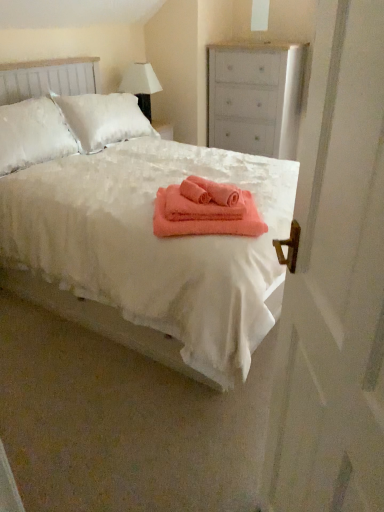
Image resolution: width=384 pixels, height=512 pixels. What do you see at coordinates (147, 241) in the screenshot? I see `white fluffy bed at center` at bounding box center [147, 241].

The width and height of the screenshot is (384, 512). I want to click on coral soft towel at center, the second bath towel when ordered from top to bottom, so click(205, 210).

At what (x,y) coordinates should I click in order to perform the action: click on white matte chest of drawers at upper right. Please return your answer as a coordinate pair (x, y). Looking at the image, I should click on (256, 97).

Is white fabric lampshade at upper center at the back of coral soft towel at center, the 1th bath towel in the bottom-to-top sequence?

Yes, white fabric lampshade at upper center is at the back of coral soft towel at center, the 1th bath towel in the bottom-to-top sequence.

Is coral soft towel at center, the 1th bath towel in the bottom-to-top sequence, far away from white fabric lampshade at upper center?

Yes.

Considering the relative sizes of coral soft towel at center, the 1th bath towel in the bottom-to-top sequence, and white fabric lampshade at upper center in the image provided, is coral soft towel at center, the 1th bath towel in the bottom-to-top sequence, thinner than white fabric lampshade at upper center?

In fact, coral soft towel at center, the 1th bath towel in the bottom-to-top sequence, might be wider than white fabric lampshade at upper center.

From the image's perspective, is white matte chest of drawers at upper right located beneath white matte screen door at right?

No.

Considering the relative sizes of white matte chest of drawers at upper right and white matte screen door at right in the image provided, is white matte chest of drawers at upper right smaller than white matte screen door at right?

Actually, white matte chest of drawers at upper right might be larger than white matte screen door at right.

Find the location of a particular element. This screenshot has width=384, height=512. chest of drawers above the white matte screen door at right (from the image's perspective) is located at coordinates (256, 97).

Considering the sizes of objects white matte screen door at right and coral soft towel at center, the 2th bath towel ordered from the bottom, in the image provided, who is bigger, white matte screen door at right or coral soft towel at center, the 2th bath towel ordered from the bottom,?

Bigger between the two is white matte screen door at right.

From a real-world perspective, which object rests below the other?

white matte screen door at right is physically lower.

Is white matte screen door at right not inside coral soft towel at center, which appears as the first bath towel when viewed from the top?

Yes.

The height and width of the screenshot is (512, 384). I want to click on the 2nd bath towel above when counting from the white matte screen door at right (from the image's perspective), so click(x=197, y=205).

Is white fabric lampshade at upper center smaller than coral soft towel at center, which appears as the first bath towel when viewed from the top?

Incorrect, white fabric lampshade at upper center is not smaller in size than coral soft towel at center, which appears as the first bath towel when viewed from the top.

There is a white fabric lampshade at upper center. Where is `the 1st bath towel below it (from the image's perspective)`? The height and width of the screenshot is (512, 384). the 1st bath towel below it (from the image's perspective) is located at coordinates (197, 205).

From the image's perspective, is white fabric lampshade at upper center located above or below coral soft towel at center, which appears as the first bath towel when viewed from the top?

Based on their image positions, white fabric lampshade at upper center is located above coral soft towel at center, which appears as the first bath towel when viewed from the top.

Which is behind, white matte chest of drawers at upper right or coral soft towel at center, the second bath towel when ordered from top to bottom?

white matte chest of drawers at upper right.

Considering the relative sizes of white matte chest of drawers at upper right and coral soft towel at center, the second bath towel when ordered from top to bottom, in the image provided, is white matte chest of drawers at upper right shorter than coral soft towel at center, the second bath towel when ordered from top to bottom,?

In fact, white matte chest of drawers at upper right may be taller than coral soft towel at center, the second bath towel when ordered from top to bottom.

This screenshot has width=384, height=512. I want to click on the chest of drawers positioned vertically above the coral soft towel at center, the second bath towel when ordered from top to bottom (from a real-world perspective), so click(x=256, y=97).

Is white matte chest of drawers at upper right turned away from coral soft towel at center, the second bath towel when ordered from top to bottom?

No, white matte chest of drawers at upper right is not facing away from coral soft towel at center, the second bath towel when ordered from top to bottom.

Based on the photo, from the image's perspective, which one is positioned lower, white matte screen door at right or coral soft towel at center, the 1th bath towel in the bottom-to-top sequence?

white matte screen door at right, from the image's perspective.

Does white matte screen door at right appear on the left side of coral soft towel at center, the second bath towel when ordered from top to bottom?

In fact, white matte screen door at right is to the right of coral soft towel at center, the second bath towel when ordered from top to bottom.

Is white matte screen door at right next to coral soft towel at center, the second bath towel when ordered from top to bottom?

white matte screen door at right and coral soft towel at center, the second bath towel when ordered from top to bottom, are not in contact.

Which of these two, white matte screen door at right or coral soft towel at center, the second bath towel when ordered from top to bottom, is bigger?

white matte screen door at right.

Does point (223, 215) lie in front of point (363, 94)?

No, (223, 215) is further to viewer.

Does coral soft towel at center, the 2th bath towel ordered from the bottom, have a larger size compared to white matte screen door at right?

Incorrect, coral soft towel at center, the 2th bath towel ordered from the bottom, is not larger than white matte screen door at right.

Who is more distant, coral soft towel at center, which appears as the first bath towel when viewed from the top, or white matte screen door at right?

coral soft towel at center, which appears as the first bath towel when viewed from the top, is behind.

Is coral soft towel at center, the 2th bath towel ordered from the bottom, facing away from white matte screen door at right?

No, coral soft towel at center, the 2th bath towel ordered from the bottom, is not facing the opposite direction of white matte screen door at right.

Locate an element on the screen. the 2nd bath towel directly beneath the white fabric lampshade at upper center (from a real-world perspective) is located at coordinates (205, 210).

In order to click on screen door located below the white matte chest of drawers at upper right (from the image's perspective) in this screenshot , I will do `click(335, 282)`.

Looking at the image, which one is located further to coral soft towel at center, the second bath towel when ordered from top to bottom, white matte chest of drawers at upper right or white matte screen door at right?

The object further to coral soft towel at center, the second bath towel when ordered from top to bottom, is white matte chest of drawers at upper right.

Which object lies further to the anchor point white fabric lampshade at upper center, white fluffy bed at center or white matte screen door at right?

white matte screen door at right is positioned further to the anchor white fabric lampshade at upper center.

Looking at this image, which object lies nearer to the anchor point white fluffy bed at center, coral soft towel at center, the 2th bath towel ordered from the bottom, or white matte screen door at right?

coral soft towel at center, the 2th bath towel ordered from the bottom, is closer to white fluffy bed at center.

When comparing their distances from white fabric lampshade at upper center, does white fluffy bed at center or coral soft towel at center, which appears as the first bath towel when viewed from the top, seem closer?

white fluffy bed at center.

When comparing their distances from coral soft towel at center, the 1th bath towel in the bottom-to-top sequence, does coral soft towel at center, the 2th bath towel ordered from the bottom, or white matte chest of drawers at upper right seem further?

Among the two, white matte chest of drawers at upper right is located further to coral soft towel at center, the 1th bath towel in the bottom-to-top sequence.

Which object lies nearer to the anchor point white fluffy bed at center, white fabric lampshade at upper center or white matte chest of drawers at upper right?

Among the two, white fabric lampshade at upper center is located nearer to white fluffy bed at center.

Based on their spatial positions, is coral soft towel at center, the second bath towel when ordered from top to bottom, or coral soft towel at center, which appears as the first bath towel when viewed from the top, further from white matte screen door at right?

coral soft towel at center, which appears as the first bath towel when viewed from the top, is further to white matte screen door at right.

From the image, which object appears to be nearer to white matte chest of drawers at upper right, coral soft towel at center, the 2th bath towel ordered from the bottom, or white fabric lampshade at upper center?

The object closer to white matte chest of drawers at upper right is white fabric lampshade at upper center.

Where is `bath towel between white fluffy bed at center and coral soft towel at center, the 2th bath towel ordered from the bottom, in the front-back direction`? The height and width of the screenshot is (512, 384). bath towel between white fluffy bed at center and coral soft towel at center, the 2th bath towel ordered from the bottom, in the front-back direction is located at coordinates (205, 210).

The height and width of the screenshot is (512, 384). Find the location of `bed positioned between white matte screen door at right and coral soft towel at center, the second bath towel when ordered from top to bottom, from near to far`. bed positioned between white matte screen door at right and coral soft towel at center, the second bath towel when ordered from top to bottom, from near to far is located at coordinates (147, 241).

Where is `bath towel between coral soft towel at center, the 1th bath towel in the bottom-to-top sequence, and white fabric lampshade at upper center in the front-back direction`? This screenshot has width=384, height=512. bath towel between coral soft towel at center, the 1th bath towel in the bottom-to-top sequence, and white fabric lampshade at upper center in the front-back direction is located at coordinates (197, 205).

The height and width of the screenshot is (512, 384). Find the location of `the chest of drawers located between white fluffy bed at center and white fabric lampshade at upper center in the depth direction`. the chest of drawers located between white fluffy bed at center and white fabric lampshade at upper center in the depth direction is located at coordinates (256, 97).